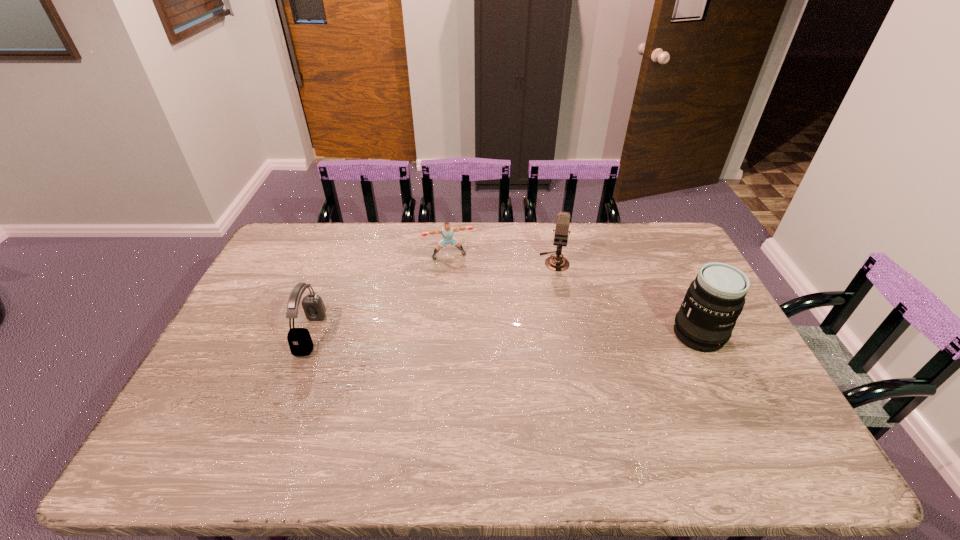
I want to click on vacant spot on the desktop that is between the leftmost object and the telephoto lens and is positioned on the front-facing side of the second object from right to left, so click(x=548, y=334).

At what (x,y) coordinates should I click in order to perform the action: click on free spot on the desktop that is between the second shortest object and the rightmost object and is positioned on the front-facing side of the shortest object. Please return your answer as a coordinate pair (x, y). This screenshot has height=540, width=960. Looking at the image, I should click on (472, 334).